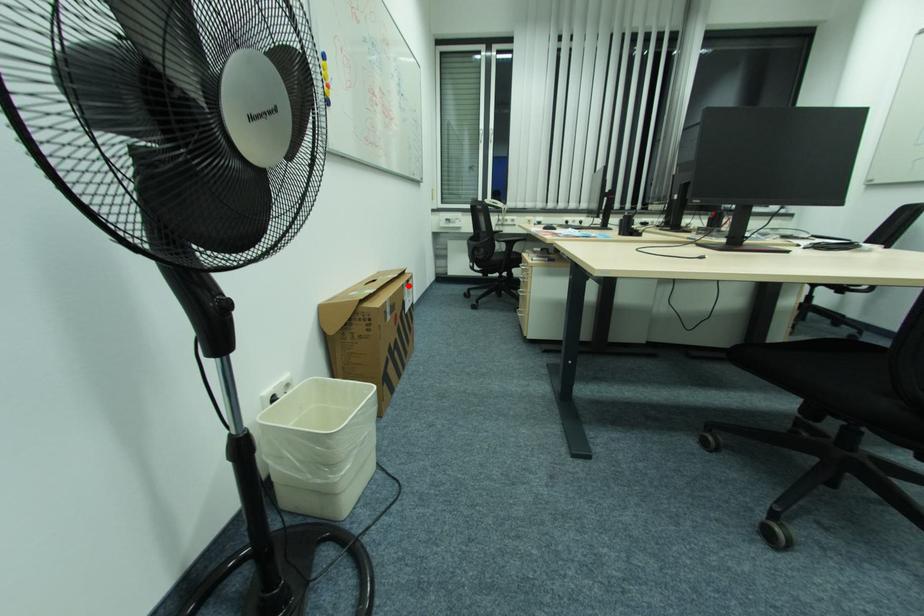
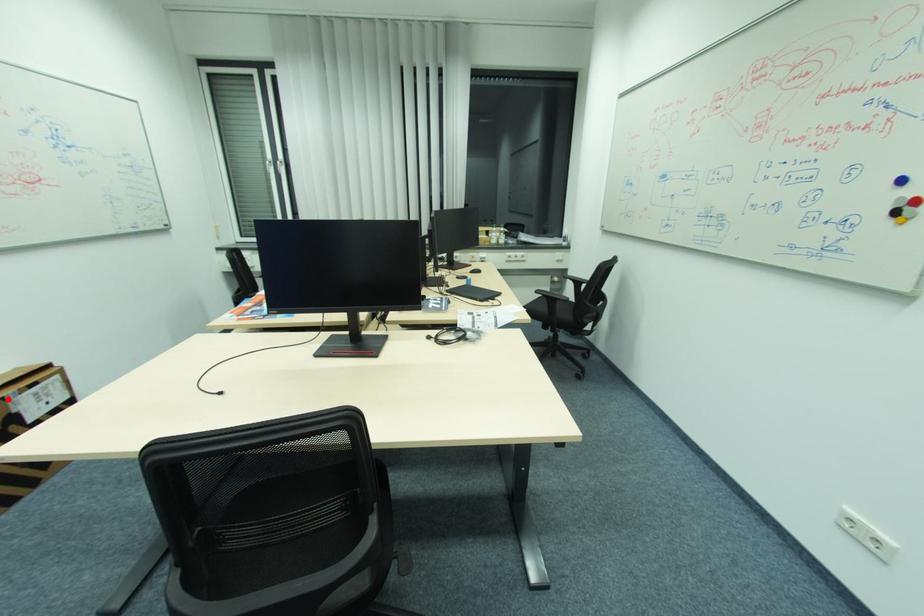
I am providing you with two images of the same scene from different viewpoints. A red point is marked on the first image and another point is marked on the second image. Does the point marked in image1 correspond to the same location as the one in image2?

Yes